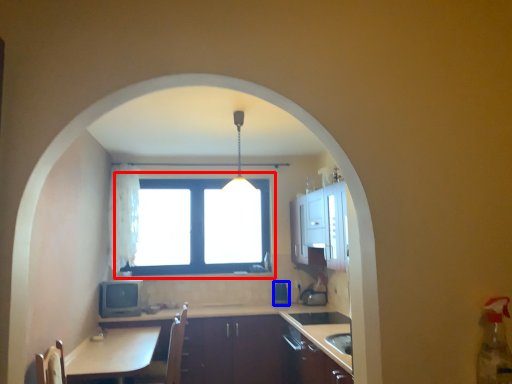
Question: Which object appears farthest to the camera in this image, window (highlighted by a red box) or appliance (highlighted by a blue box)?

Choices:
 (A) window
 (B) appliance

Answer: (A)